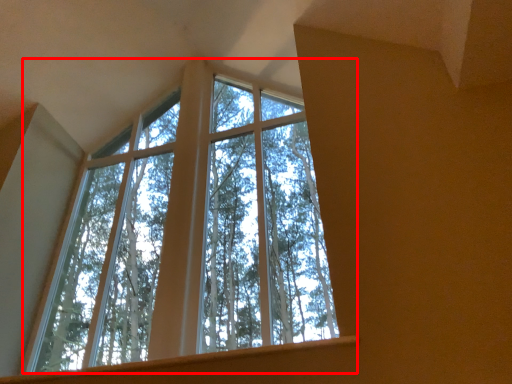
Question: From the image, what is the correct spatial relationship of window (annotated by the red box) in relation to window sill?

Choices:
 (A) left
 (B) right

Answer: (A)